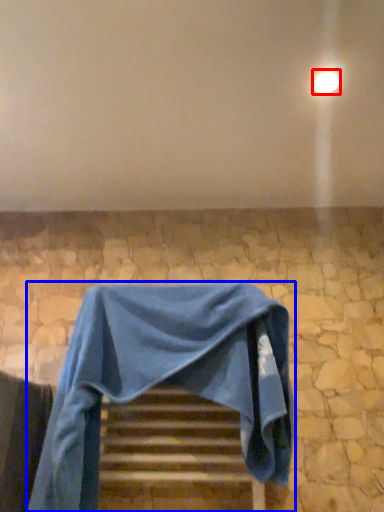
Question: Among these objects, which one is nearest to the camera, light (highlighted by a red box) or furniture (highlighted by a blue box)?

Choices:
 (A) light
 (B) furniture

Answer: (B)